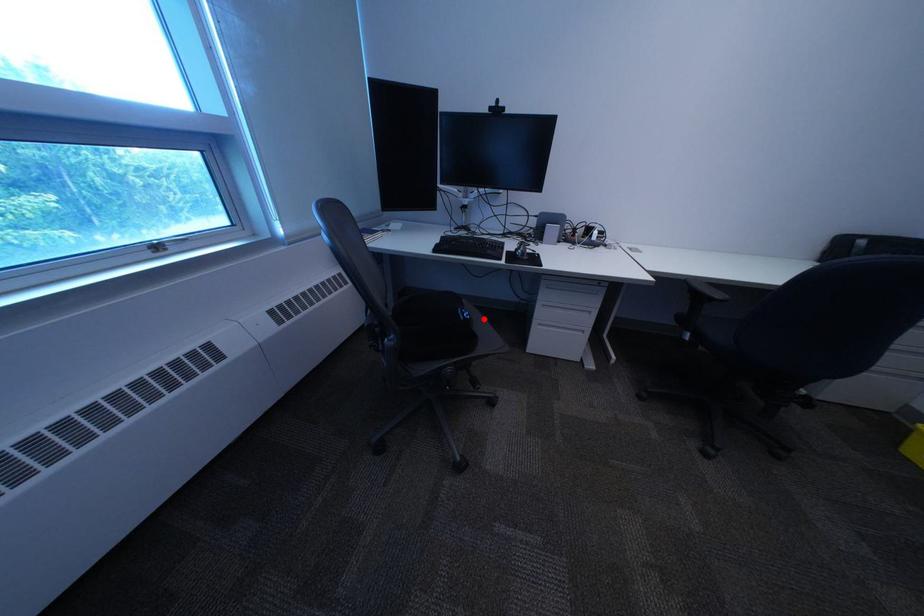
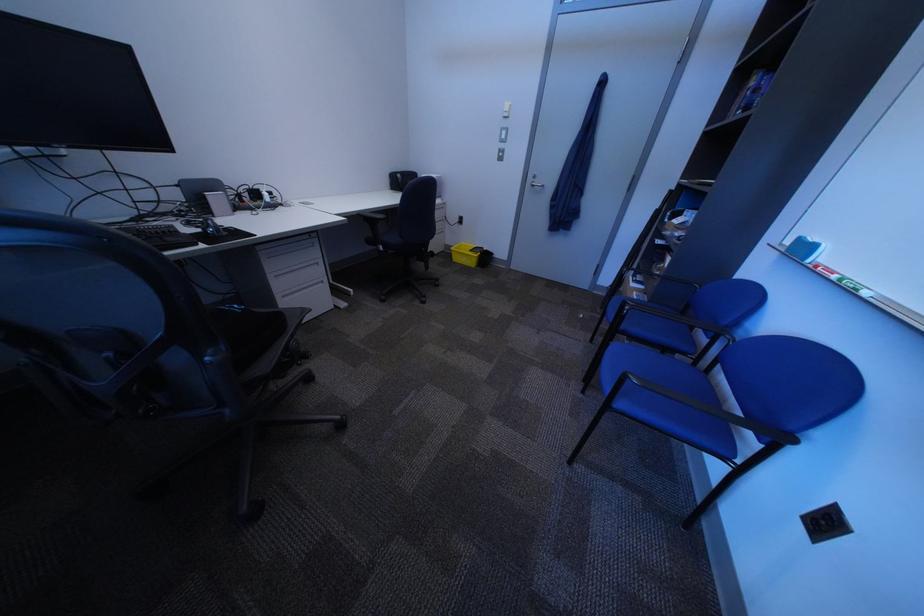
Question: I am providing you with two images of the same scene from different viewpoints. In image1, a red point is highlighted. Considering the same 3D point in image2, which of the following is correct?

Choices:
 (A) It is closer
 (B) It is farther

Answer: (A)